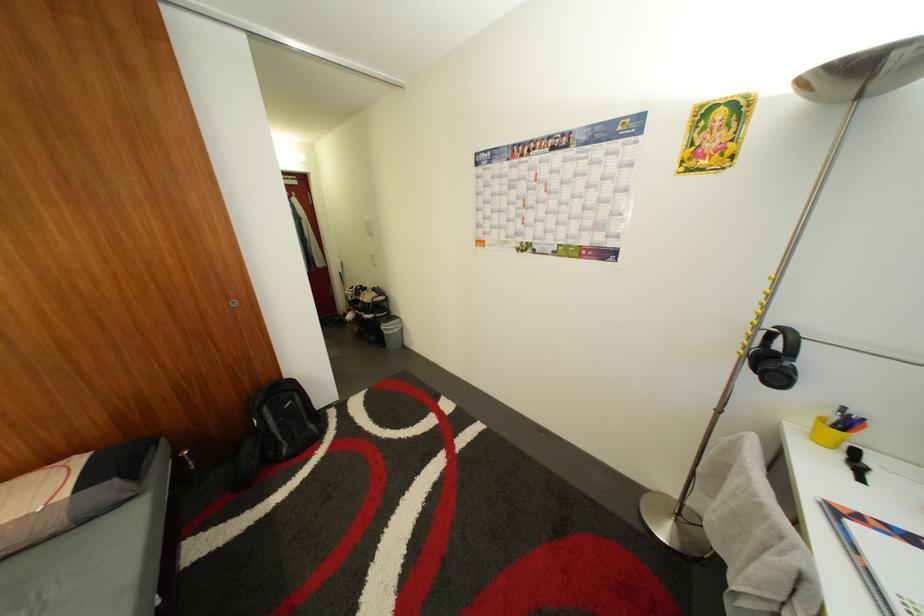
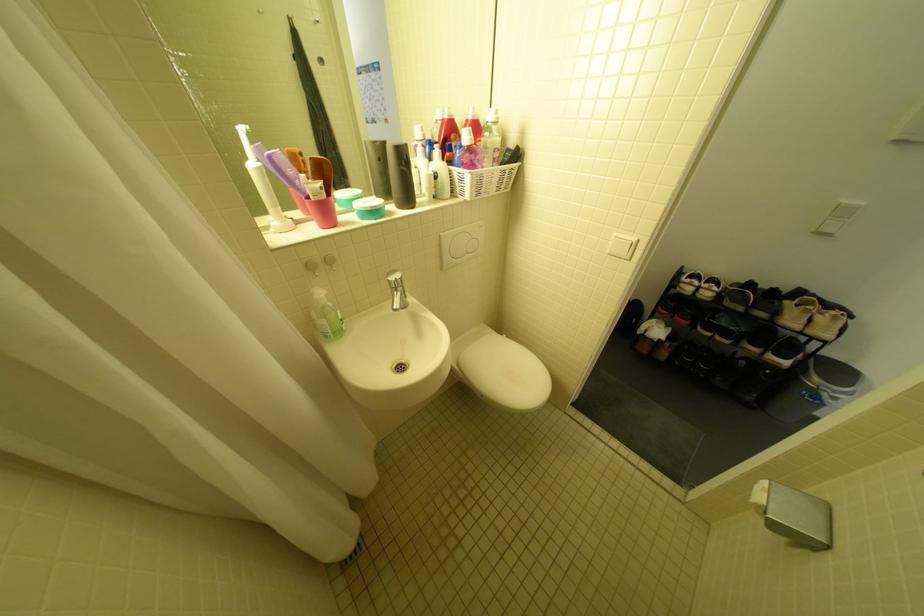
The images are taken continuously from a first-person perspective. In which direction are you moving?

The movement direction of the cameraman is left, forward.